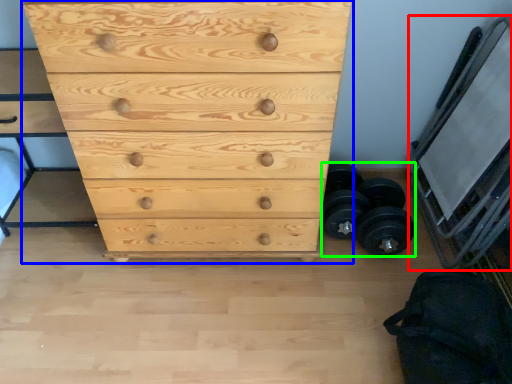
Question: Considering the real-world distances, which object is farthest from bunk bed (highlighted by a red box)? chest of drawers (highlighted by a blue box) or dumbbell (highlighted by a green box)?

Choices:
 (A) chest of drawers
 (B) dumbbell

Answer: (A)